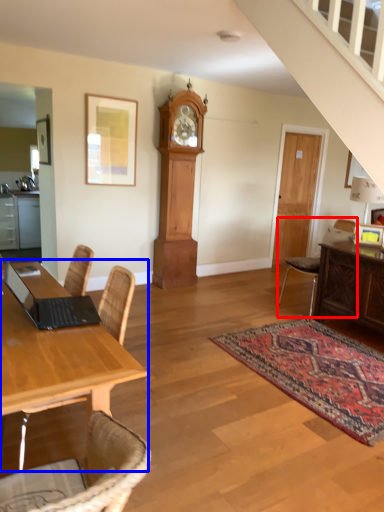
Question: Which object is further to the camera taking this photo, chair (highlighted by a red box) or desk (highlighted by a blue box)?

Choices:
 (A) chair
 (B) desk

Answer: (A)